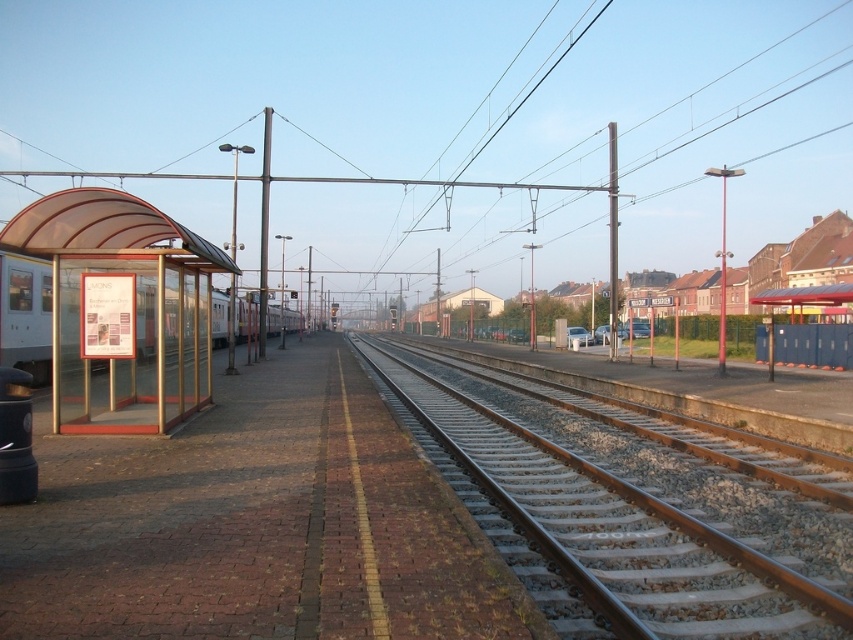
You are a pedestrian trying to cross the platform to reach the train. There is a transparent plastic bus stop at left and a silver metallic train at left blocking your path. Can you walk between them?

The transparent plastic bus stop at left is thinner than silver metallic train at left, so there is enough space between them for you to walk through.